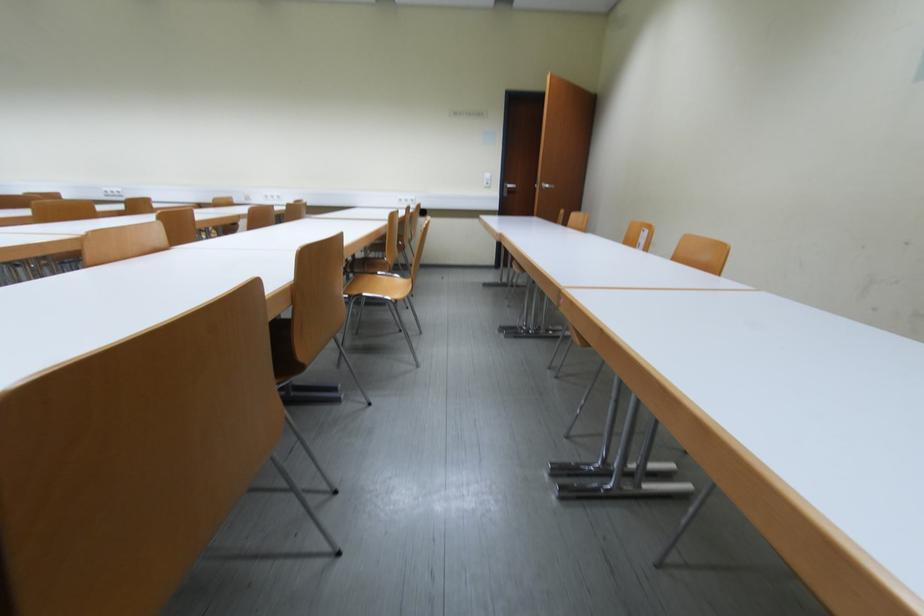
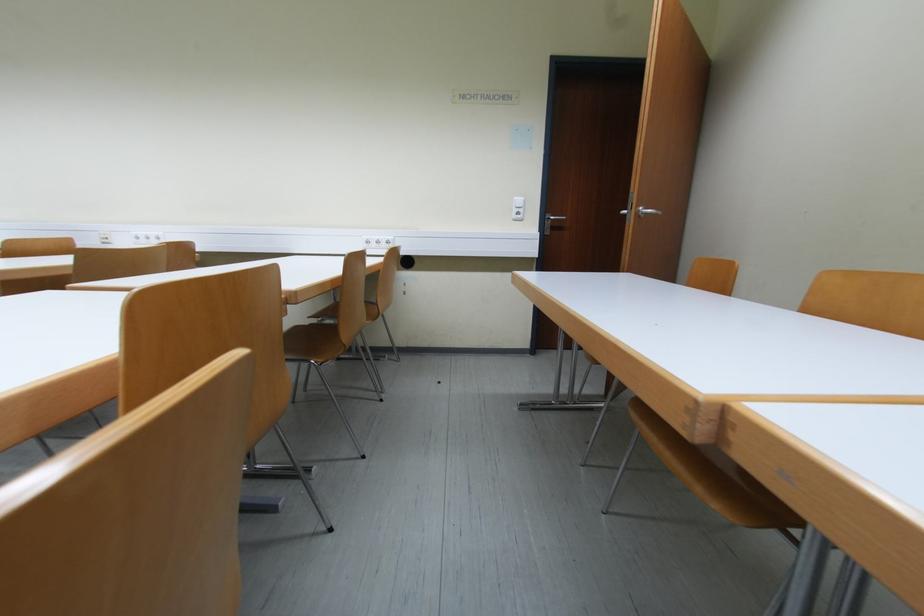
Question: Which direction would the cameraman need to move to produce the second image? Reply with the corresponding letter.

Choices:
 (A) Left
 (B) Right
 (C) Forward
 (D) Backward

Answer: (C)